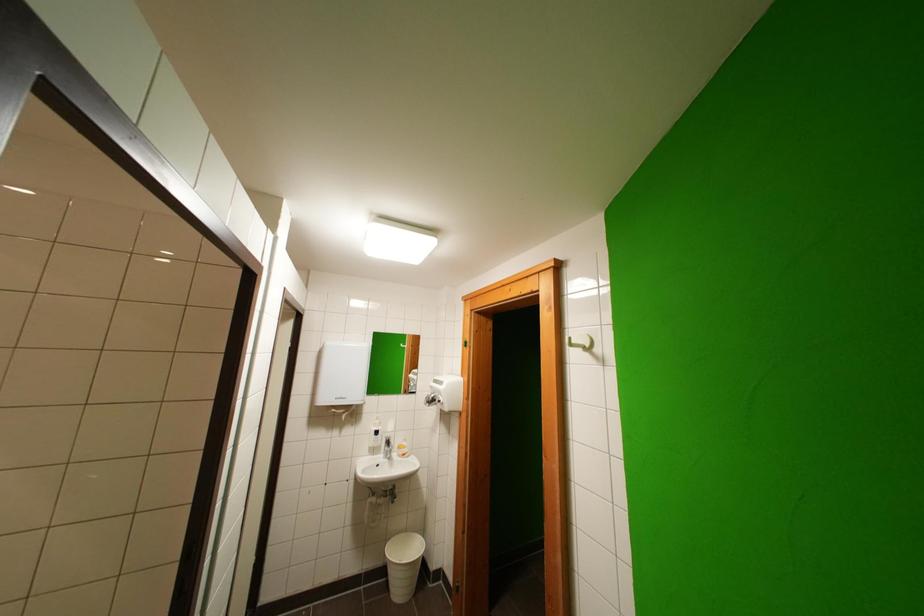
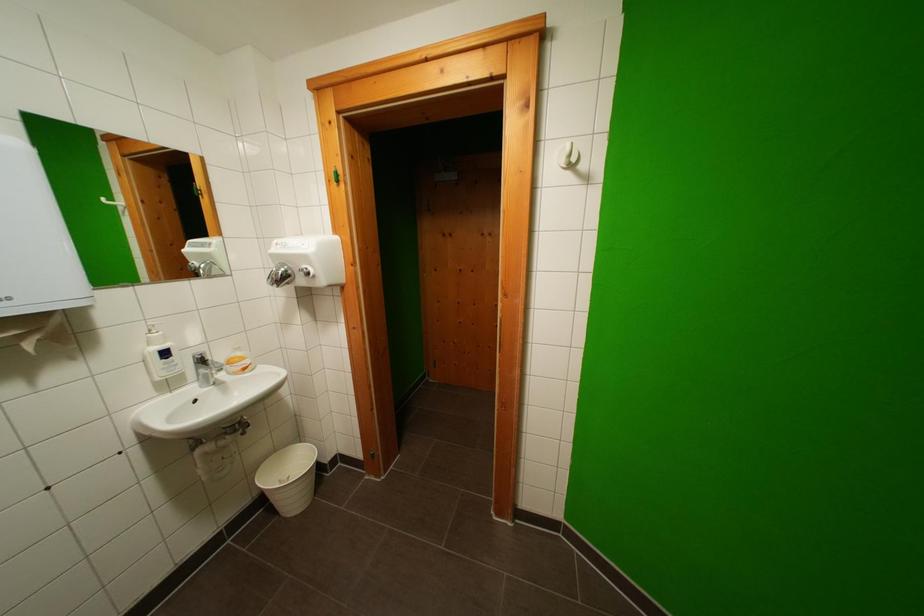
First-person continuous shooting, in which direction is the camera rotating?

The camera's rotation is toward right-down.